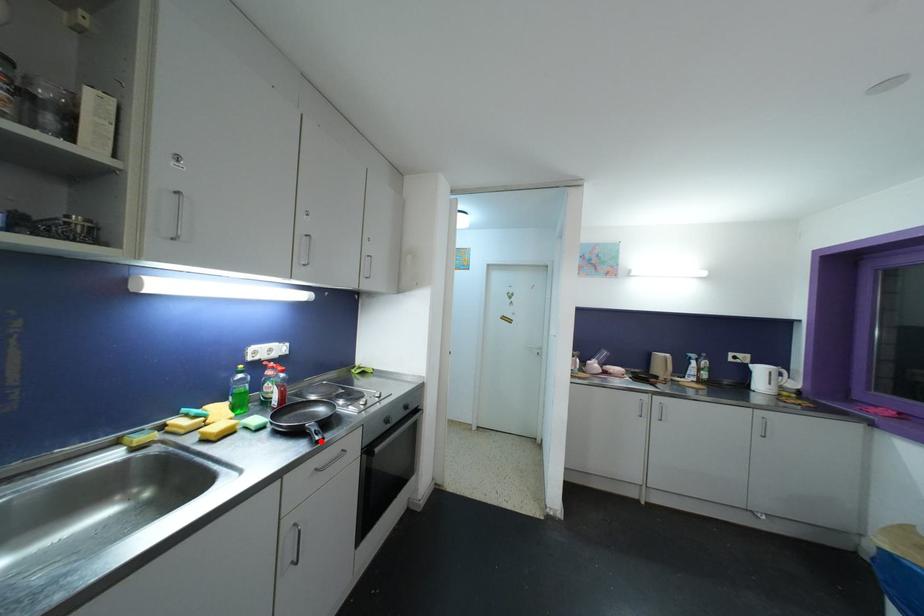
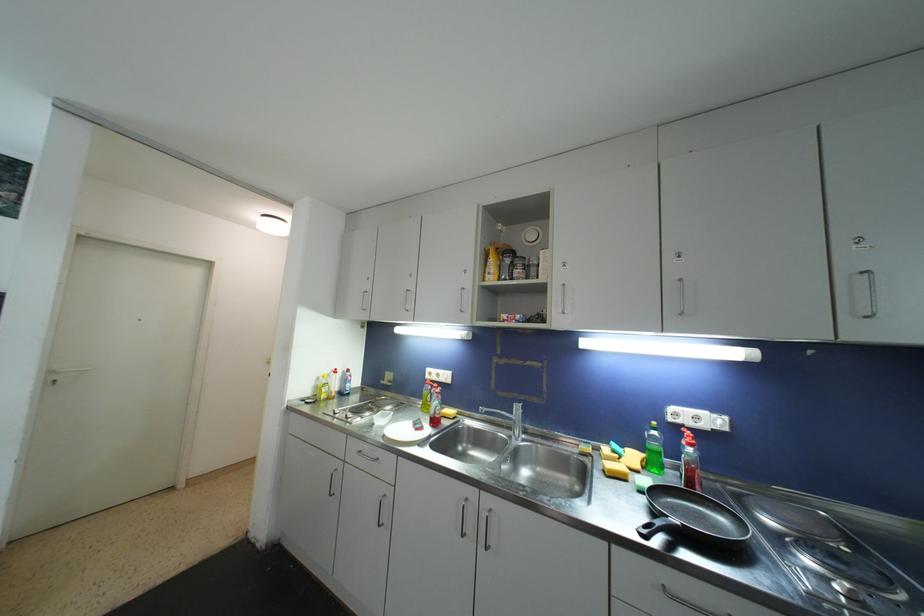
Question: I am providing you with two images of the same scene from different viewpoints. In image1, a red point is highlighted. Considering the same 3D point in image2, which of the following is correct?

Choices:
 (A) It is closer
 (B) It is farther

Answer: (B)